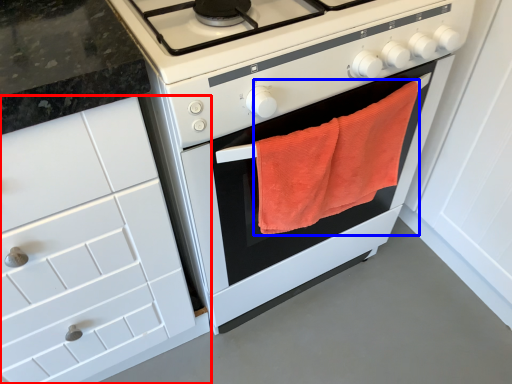
Question: Which object appears farthest to the camera in this image, cabinetry (highlighted by a red box) or beach towel (highlighted by a blue box)?

Choices:
 (A) cabinetry
 (B) beach towel

Answer: (B)